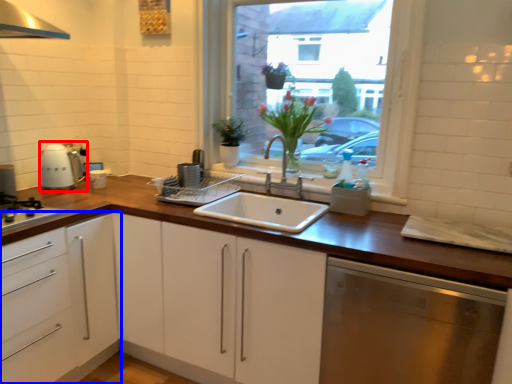
Question: Which of the following is the closest to the observer, kitchen appliance (highlighted by a red box) or cabinetry (highlighted by a blue box)?

Choices:
 (A) kitchen appliance
 (B) cabinetry

Answer: (B)